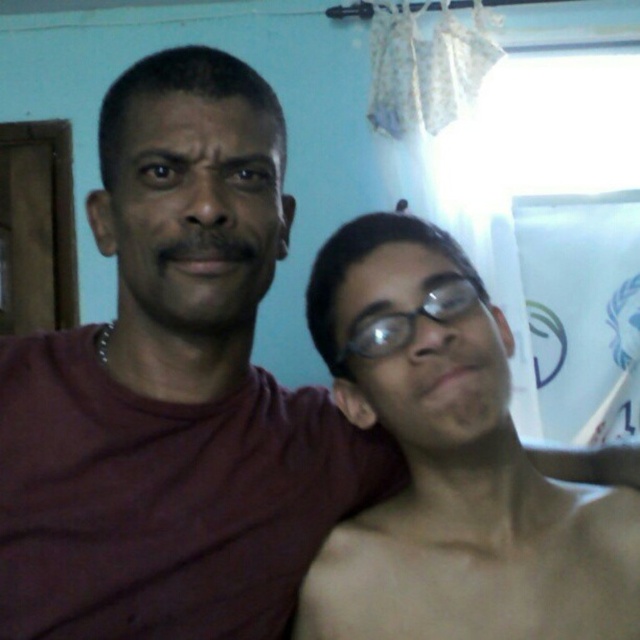
Question: Is shiny black glasses at right to the left of black plastic glasses at center from the viewer's perspective?

Choices:
 (A) yes
 (B) no

Answer: (B)

Question: Among these objects, which one is nearest to the camera?

Choices:
 (A) shiny black glasses at right
 (B) black plastic glasses at center

Answer: (A)

Question: Which point is closer to the camera?

Choices:
 (A) (467, 310)
 (B) (461, 577)

Answer: (A)

Question: Which of the following is the closest to the observer?

Choices:
 (A) (432, 316)
 (B) (512, 620)

Answer: (A)

Question: Observing the image, what is the correct spatial positioning of shiny black glasses at right in reference to black plastic glasses at center?

Choices:
 (A) left
 (B) right

Answer: (B)

Question: Where is shiny black glasses at right located in relation to black plastic glasses at center in the image?

Choices:
 (A) left
 (B) right

Answer: (B)